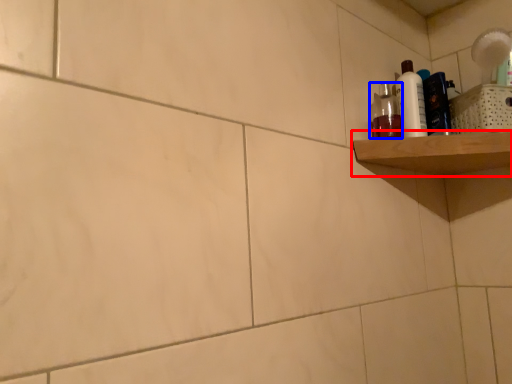
Question: Which object is closer to the camera taking this photo, shelf (highlighted by a red box) or mouthwash (highlighted by a blue box)?

Choices:
 (A) shelf
 (B) mouthwash

Answer: (A)